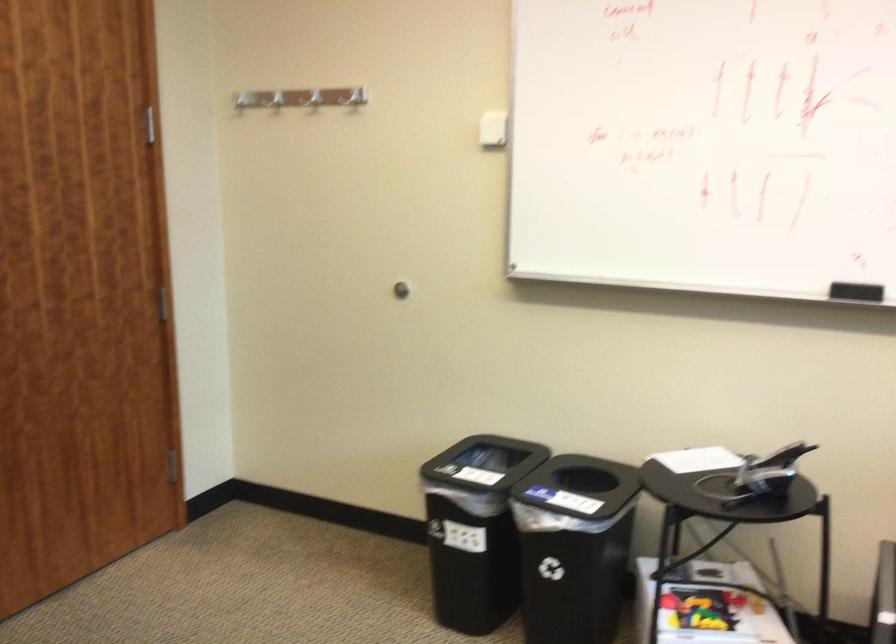
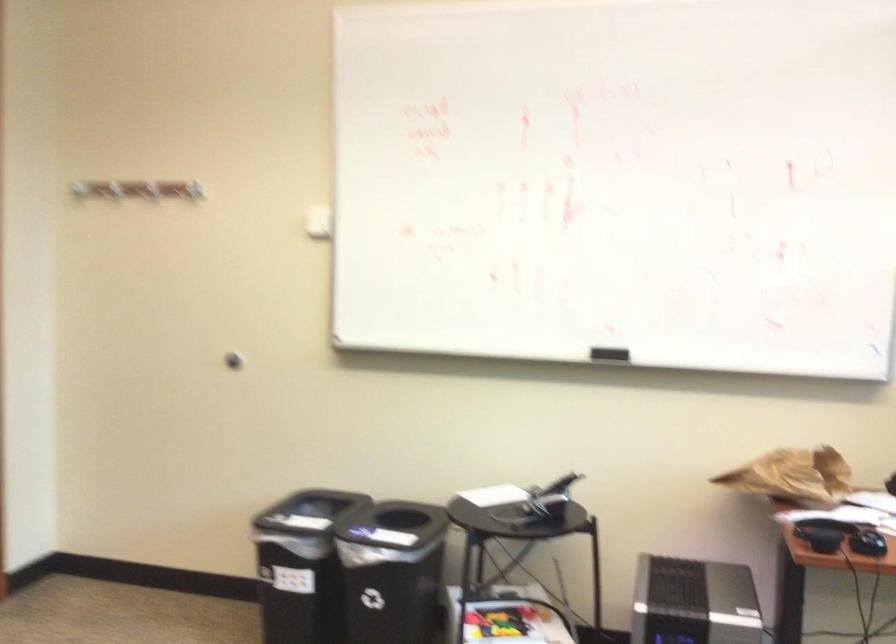
In the scene shown: What movement of the cameraman would produce the second image?

The cameraman moved toward left, backward.